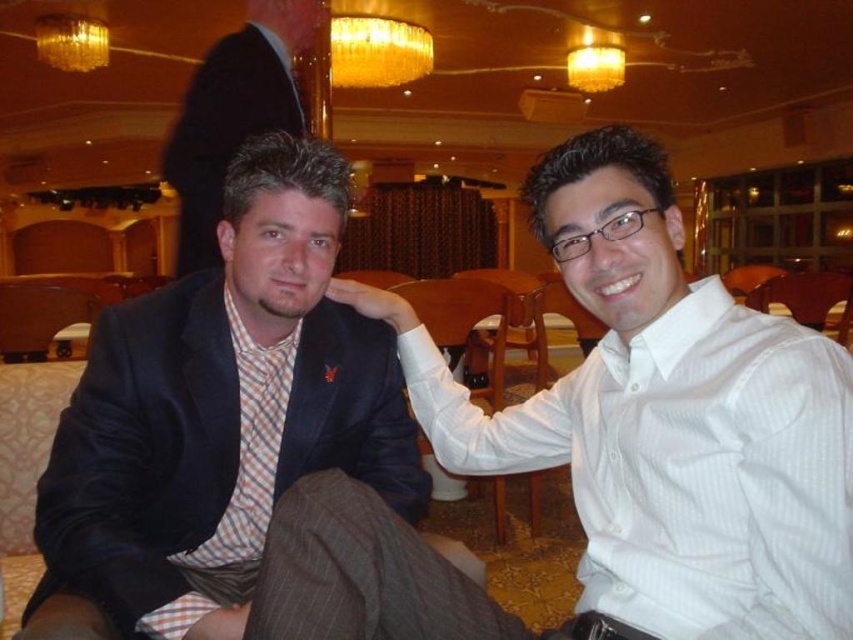
Is checkered fabric shirt at center below gold glass chandelier at upper center?

Yes, checkered fabric shirt at center is below gold glass chandelier at upper center.

Which is behind, point (368, 584) or point (74, 68)?

The point (74, 68) is behind.

Does point (772, 545) lie behind point (83, 13)?

No, it is not.

Image resolution: width=853 pixels, height=640 pixels. Identify the location of checkered fabric shirt at center. (663, 420).

Who is positioned more to the right, checkered fabric shirt at center or matte black suit at left?

checkered fabric shirt at center

Who is taller, checkered fabric shirt at center or matte black suit at left?

Standing taller between the two is matte black suit at left.

Describe the element at coordinates (663, 420) in the screenshot. I see `checkered fabric shirt at center` at that location.

Where is `checkered fabric shirt at center`? checkered fabric shirt at center is located at coordinates (663, 420).

Does checkered fabric shirt at center lie behind matte black suit at center?

No, checkered fabric shirt at center is in front of matte black suit at center.

This screenshot has width=853, height=640. What do you see at coordinates (663, 420) in the screenshot? I see `checkered fabric shirt at center` at bounding box center [663, 420].

Is point (733, 474) behind point (189, 124)?

That is False.

This screenshot has width=853, height=640. What are the coordinates of `checkered fabric shirt at center` in the screenshot? It's located at (663, 420).